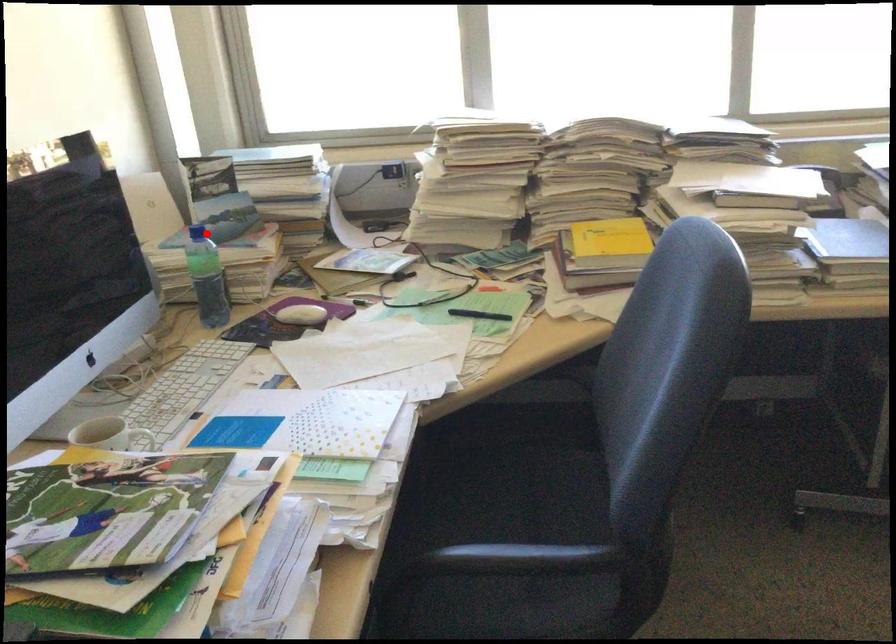
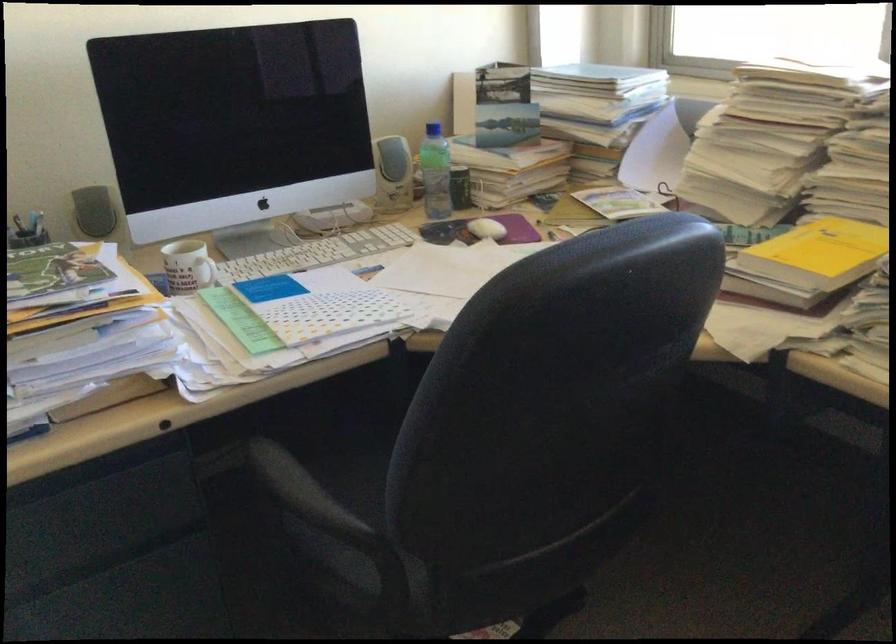
The point at the highlighted location is marked in the first image. Where is the corresponding point in the second image?

(433, 129)